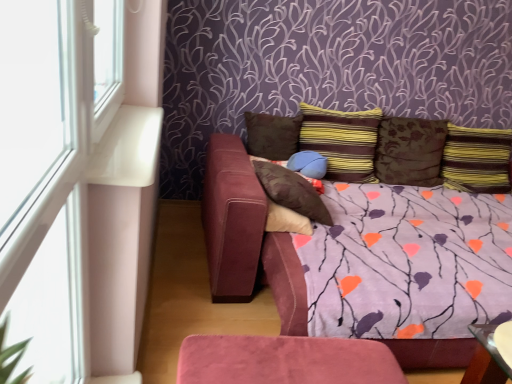
Question: Does striped fabric pillow at center, arranged as the third pillow when viewed from the right, have a lesser height compared to striped fabric pillow at upper right, marked as the 1th pillow in a right-to-left arrangement?

Choices:
 (A) yes
 (B) no

Answer: (B)

Question: Can you confirm if striped fabric pillow at center, arranged as the third pillow when viewed from the right, is taller than striped fabric pillow at upper right, marked as the 1th pillow in a right-to-left arrangement?

Choices:
 (A) yes
 (B) no

Answer: (A)

Question: Is striped fabric pillow at upper right, which is counted as the sixth pillow, starting from the left, at the back of striped fabric pillow at center, acting as the 4th pillow starting from the left?

Choices:
 (A) no
 (B) yes

Answer: (A)

Question: Does striped fabric pillow at center, acting as the 4th pillow starting from the left, have a greater width compared to striped fabric pillow at upper right, which is counted as the sixth pillow, starting from the left?

Choices:
 (A) yes
 (B) no

Answer: (A)

Question: Is striped fabric pillow at center, acting as the 4th pillow starting from the left, to the left of striped fabric pillow at upper right, which is counted as the sixth pillow, starting from the left, from the viewer's perspective?

Choices:
 (A) no
 (B) yes

Answer: (B)

Question: In terms of height, does striped fabric pillow at center, arranged as the third pillow when viewed from the right, look taller or shorter compared to white plastic window frame at left?

Choices:
 (A) short
 (B) tall

Answer: (A)

Question: Considering their positions, is striped fabric pillow at center, arranged as the third pillow when viewed from the right, located in front of or behind white plastic window frame at left?

Choices:
 (A) behind
 (B) front

Answer: (A)

Question: In terms of size, does striped fabric pillow at center, acting as the 4th pillow starting from the left, appear bigger or smaller than white plastic window frame at left?

Choices:
 (A) big
 (B) small

Answer: (A)

Question: Visually, is striped fabric pillow at center, arranged as the third pillow when viewed from the right, positioned to the left or to the right of white plastic window frame at left?

Choices:
 (A) left
 (B) right

Answer: (B)

Question: From a real-world perspective, relative to brown suede pillow at center, which is the first pillow from left to right, is striped fabric pillow at center, acting as the 4th pillow starting from the left, vertically above or below?

Choices:
 (A) above
 (B) below

Answer: (A)

Question: Considering the positions of striped fabric pillow at center, acting as the 4th pillow starting from the left, and brown suede pillow at center, which is the first pillow from left to right, in the image, is striped fabric pillow at center, acting as the 4th pillow starting from the left, bigger or smaller than brown suede pillow at center, which is the first pillow from left to right,?

Choices:
 (A) big
 (B) small

Answer: (A)

Question: Considering the relative positions of striped fabric pillow at center, acting as the 4th pillow starting from the left, and brown suede pillow at center, the 6th pillow from the right, in the image provided, is striped fabric pillow at center, acting as the 4th pillow starting from the left, to the left or to the right of brown suede pillow at center, the 6th pillow from the right,?

Choices:
 (A) right
 (B) left

Answer: (A)

Question: Is point (313, 122) closer or farther from the camera than point (269, 114)?

Choices:
 (A) farther
 (B) closer

Answer: (B)

Question: From the image's perspective, is velvet brown pillow at center, acting as the 5th pillow starting from the right, positioned above or below striped fabric pillow at center, arranged as the third pillow when viewed from the right?

Choices:
 (A) below
 (B) above

Answer: (A)

Question: From a real-world perspective, is velvet brown pillow at center, acting as the 5th pillow starting from the right, physically located above or below striped fabric pillow at center, acting as the 4th pillow starting from the left?

Choices:
 (A) above
 (B) below

Answer: (B)